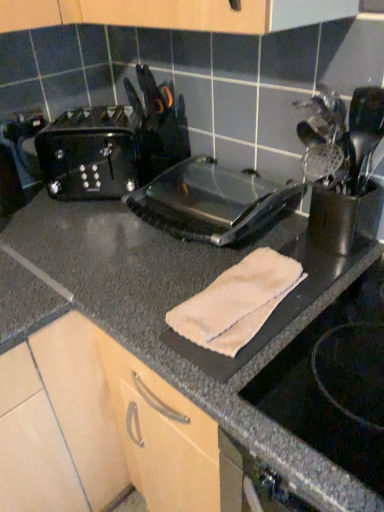
Locate an element on the screen. The height and width of the screenshot is (512, 384). vacant area that is in front of beige cotton towel at center is located at coordinates (276, 385).